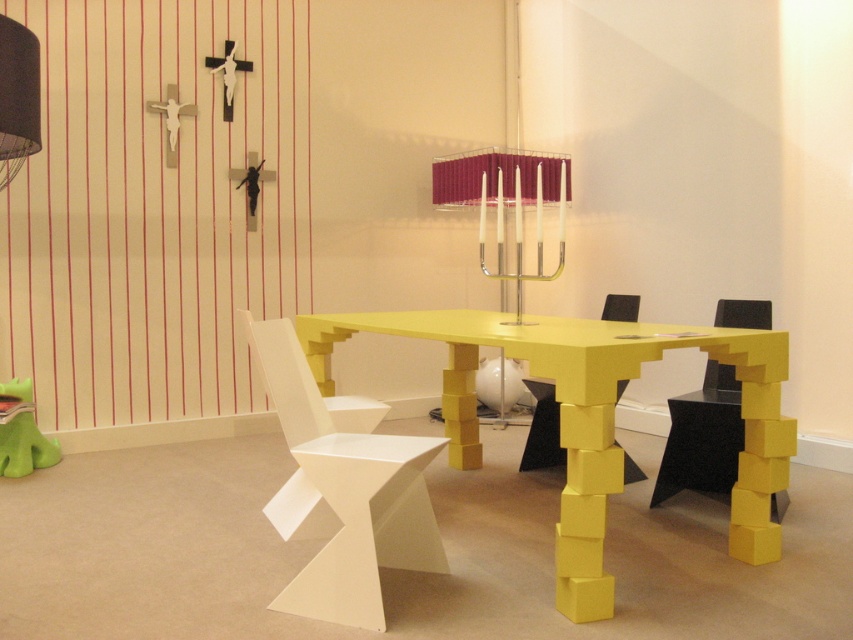
Consider the image. Who is more forward, (564, 362) or (689, 436)?

Point (564, 362)

The height and width of the screenshot is (640, 853). Describe the element at coordinates (590, 417) in the screenshot. I see `yellow matte table at center` at that location.

Does point (573, 422) come closer to viewer compared to point (677, 436)?

Yes, point (573, 422) is in front of point (677, 436).

I want to click on yellow matte table at center, so click(x=590, y=417).

Which of these two, yellow matte table at center or white matte chair at center, stands shorter?

white matte chair at center is shorter.

Which is more to the right, yellow matte table at center or white matte chair at center?

yellow matte table at center

Image resolution: width=853 pixels, height=640 pixels. I want to click on yellow matte table at center, so click(x=590, y=417).

Is point (595, 474) farther from camera compared to point (616, 316)?

That is False.

How much distance is there between yellow matte table at center and matte white chair at center?

A distance of 30.22 inches exists between yellow matte table at center and matte white chair at center.

Between point (775, 369) and point (627, 314), which one is positioned behind?

The point (627, 314) is more distant.

This screenshot has height=640, width=853. What are the coordinates of `yellow matte table at center` in the screenshot? It's located at (590, 417).